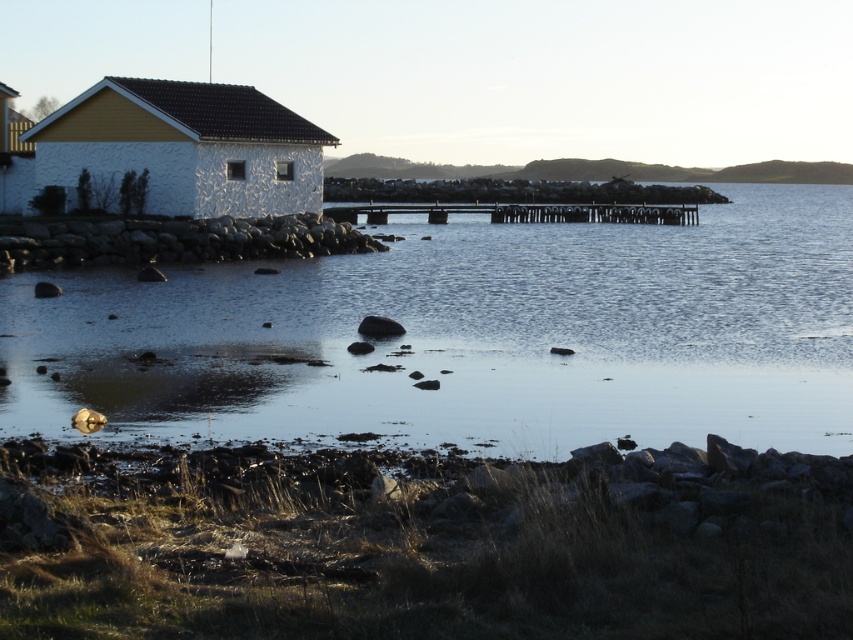
Which is more to the left, clear water at center or smooth gray rock at center?

From the viewer's perspective, smooth gray rock at center appears more on the left side.

Is point (653, 404) positioned behind point (363, 326)?

No, (653, 404) is closer to viewer.

Is point (612, 426) more distant than point (369, 332)?

That is False.

What are the coordinates of `clear water at center` in the screenshot? It's located at (473, 336).

Does gray rock at lower left appear on the left side of brown wooden dock at center?

Yes, gray rock at lower left is to the left of brown wooden dock at center.

Based on the photo, is gray rock at lower left above brown wooden dock at center?

Actually, gray rock at lower left is below brown wooden dock at center.

Who is more forward, (90, 234) or (619, 204)?

Positioned in front is point (90, 234).

What are the coordinates of `gray rock at lower left` in the screenshot? It's located at [x=175, y=241].

Is gray rock at lower left smaller than smooth gray rock at center?

Actually, gray rock at lower left might be larger than smooth gray rock at center.

Between point (241, 218) and point (370, 323), which one is positioned behind?

The point (241, 218) is more distant.

The image size is (853, 640). Find the location of `gray rock at lower left`. gray rock at lower left is located at coordinates (175, 241).